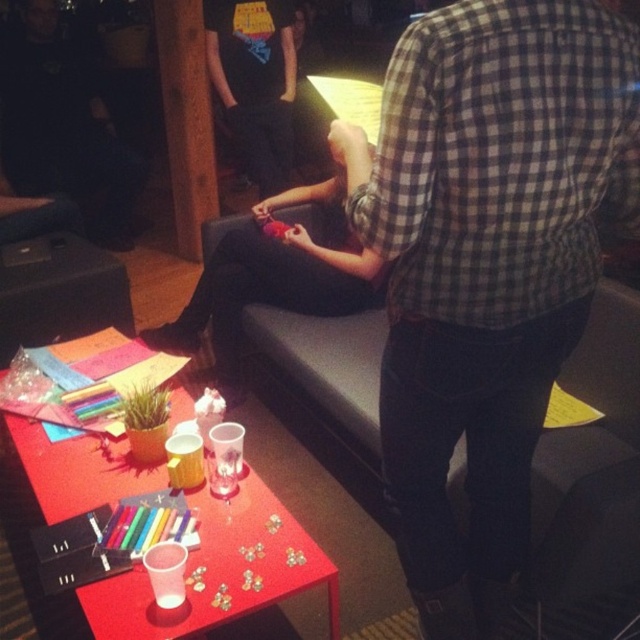
Can you confirm if matte black shirt at upper center is shorter than matte black pants at center?

Incorrect, matte black shirt at upper center's height does not fall short of matte black pants at center's.

Which is in front, point (19, 164) or point (179, 344)?

Point (179, 344)

Does point (113, 148) lie in front of point (211, 284)?

No.

Where is `matte black shirt at upper center`? The height and width of the screenshot is (640, 640). matte black shirt at upper center is located at coordinates (61, 125).

At what (x,y) coordinates should I click in order to perform the action: click on translucent plastic table at center. Please return your answer as a coordinate pair (x, y). Image resolution: width=640 pixels, height=640 pixels. Looking at the image, I should click on (221, 570).

Between point (337, 609) and point (182, 205), which one is positioned in front?

Point (337, 609) is in front.

Find the location of a particular element. The width and height of the screenshot is (640, 640). translucent plastic table at center is located at coordinates (221, 570).

Identify the location of translucent plastic table at center. (221, 570).

Is checkered fabric shirt at center to the right of matte black pants at center from the viewer's perspective?

Correct, you'll find checkered fabric shirt at center to the right of matte black pants at center.

Is checkered fabric shirt at center bigger than matte black pants at center?

Incorrect, checkered fabric shirt at center is not larger than matte black pants at center.

The width and height of the screenshot is (640, 640). In order to click on checkered fabric shirt at center in this screenshot , I will do `click(486, 262)`.

Locate an element on the screen. The width and height of the screenshot is (640, 640). checkered fabric shirt at center is located at coordinates (486, 262).